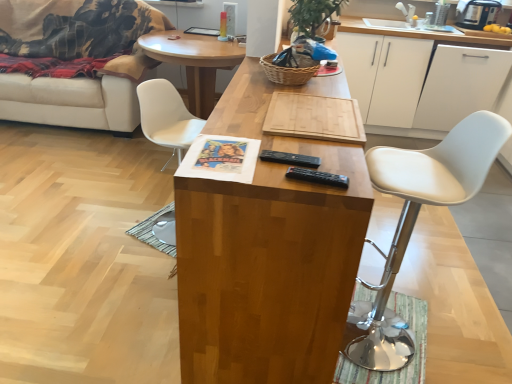
Identify the location of free space to the left of natural wood cutting board at center. This screenshot has width=512, height=384. (238, 111).